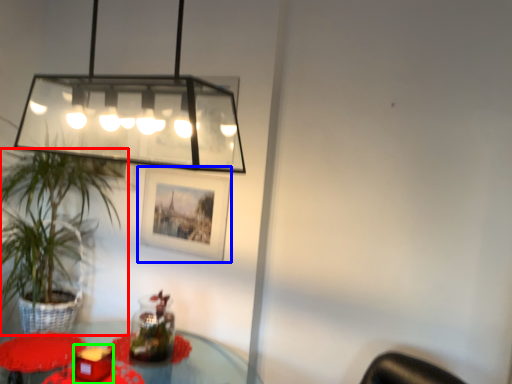
Question: Which object is the farthest from houseplant (highlighted by a red box)? Choose among these: picture frame (highlighted by a blue box) or candle holder (highlighted by a green box).

Choices:
 (A) picture frame
 (B) candle holder

Answer: (B)